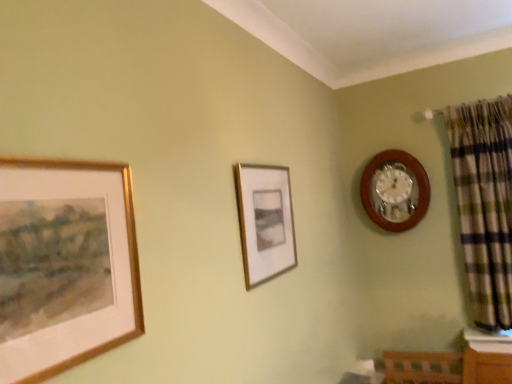
Question: Considering the relative positions of matte gold picture frame at center, positioned as the second picture frame in left-to-right order, and gold-framed painting at left, the second picture frame in the right-to-left sequence, in the image provided, is matte gold picture frame at center, positioned as the second picture frame in left-to-right order, behind gold-framed painting at left, the second picture frame in the right-to-left sequence,?

Choices:
 (A) yes
 (B) no

Answer: (A)

Question: From a real-world perspective, is matte gold picture frame at center, the 1th picture frame positioned from the back, located beneath gold-framed painting at left, which is the second picture frame from back to front?

Choices:
 (A) yes
 (B) no

Answer: (B)

Question: Is matte gold picture frame at center, arranged as the 2th picture frame when viewed from the front, to the right of gold-framed painting at left, the second picture frame in the right-to-left sequence, from the viewer's perspective?

Choices:
 (A) yes
 (B) no

Answer: (A)

Question: From the image's perspective, is matte gold picture frame at center, marked as the 1th picture frame in a right-to-left arrangement, above gold-framed painting at left, the second picture frame in the right-to-left sequence?

Choices:
 (A) yes
 (B) no

Answer: (A)

Question: From a real-world perspective, is matte gold picture frame at center, positioned as the second picture frame in left-to-right order, physically above gold-framed painting at left, which ranks as the 1th picture frame in front-to-back order?

Choices:
 (A) yes
 (B) no

Answer: (A)

Question: Considering the positions of gold-framed painting at left, the 1th picture frame when ordered from left to right, and matte gold picture frame at center, marked as the 1th picture frame in a right-to-left arrangement, in the image, is gold-framed painting at left, the 1th picture frame when ordered from left to right, taller or shorter than matte gold picture frame at center, marked as the 1th picture frame in a right-to-left arrangement,?

Choices:
 (A) tall
 (B) short

Answer: (B)

Question: Looking at the image, does gold-framed painting at left, which ranks as the 1th picture frame in front-to-back order, seem bigger or smaller compared to matte gold picture frame at center, marked as the 1th picture frame in a right-to-left arrangement?

Choices:
 (A) big
 (B) small

Answer: (B)

Question: Is gold-framed painting at left, which ranks as the 1th picture frame in front-to-back order, wider or thinner than matte gold picture frame at center, arranged as the 2th picture frame when viewed from the front?

Choices:
 (A) thin
 (B) wide

Answer: (A)

Question: From the image's perspective, is gold-framed painting at left, the second picture frame in the right-to-left sequence, above or below matte gold picture frame at center, arranged as the 2th picture frame when viewed from the front?

Choices:
 (A) below
 (B) above

Answer: (A)

Question: Is green plaid fabric at right situated inside wooden wall clock at upper right or outside?

Choices:
 (A) outside
 (B) inside

Answer: (A)

Question: Relative to wooden wall clock at upper right, is green plaid fabric at right in front or behind?

Choices:
 (A) front
 (B) behind

Answer: (A)

Question: From the image's perspective, is green plaid fabric at right positioned above or below wooden wall clock at upper right?

Choices:
 (A) below
 (B) above

Answer: (A)

Question: Is point (473, 266) closer or farther from the camera than point (373, 190)?

Choices:
 (A) farther
 (B) closer

Answer: (B)

Question: Considering their positions, is matte gold picture frame at center, marked as the 1th picture frame in a right-to-left arrangement, located in front of or behind green plaid fabric at right?

Choices:
 (A) front
 (B) behind

Answer: (A)

Question: Is matte gold picture frame at center, the 1th picture frame positioned from the back, taller or shorter than green plaid fabric at right?

Choices:
 (A) short
 (B) tall

Answer: (A)